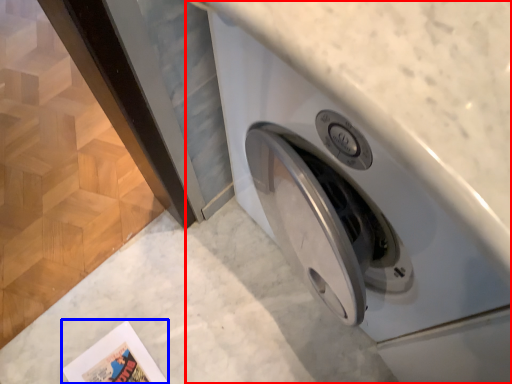
Question: Which object appears farthest to the camera in this image, washing machine (highlighted by a red box) or comic book (highlighted by a blue box)?

Choices:
 (A) washing machine
 (B) comic book

Answer: (B)